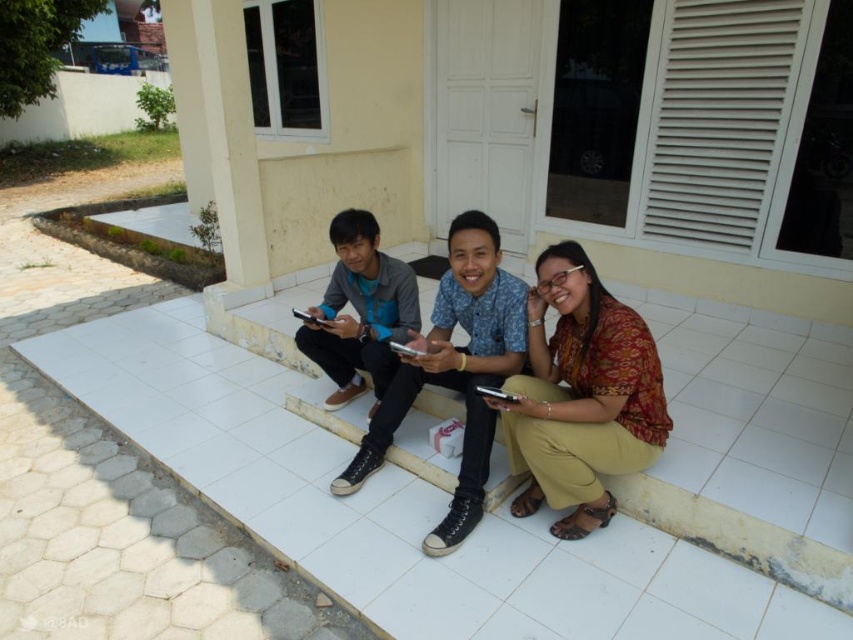
Question: Can you confirm if printed cotton shirt at center is wider than matte gray sneakers at center?

Choices:
 (A) no
 (B) yes

Answer: (B)

Question: Is matte black sneakers at center below matte gray sneakers at center?

Choices:
 (A) no
 (B) yes

Answer: (B)

Question: Considering the real-world distances, which object is farthest from the matte gray sneakers at center?

Choices:
 (A) printed cotton shirt at center
 (B) matte black sneakers at center

Answer: (A)

Question: Which point is closer to the camera?

Choices:
 (A) (428, 381)
 (B) (412, 284)

Answer: (A)

Question: Which point is farther to the camera?

Choices:
 (A) matte black sneakers at center
 (B) matte gray sneakers at center

Answer: (B)

Question: Does printed cotton shirt at center appear on the left side of matte gray sneakers at center?

Choices:
 (A) no
 (B) yes

Answer: (A)